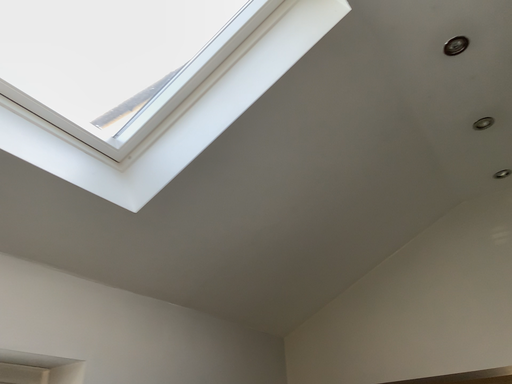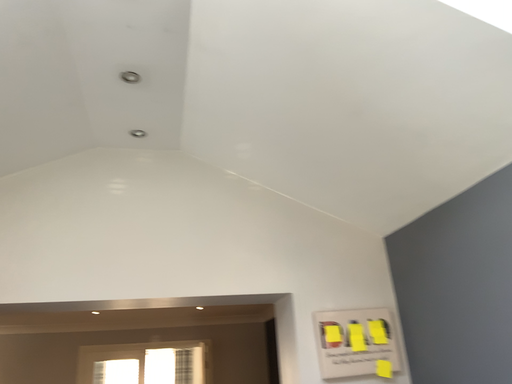
Question: Which way did the camera rotate in the video?

Choices:
 (A) rotated upward
 (B) rotated downward

Answer: (B)